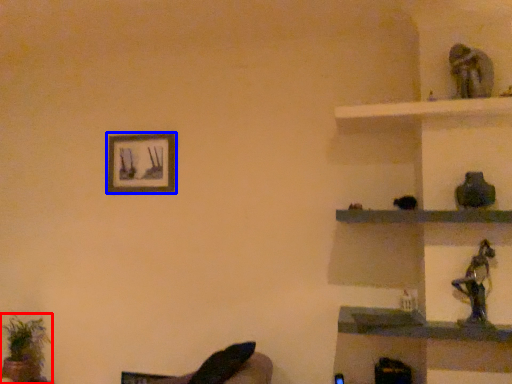
Question: Which point is closer to the camera, houseplant (highlighted by a red box) or picture frame (highlighted by a blue box)?

Choices:
 (A) houseplant
 (B) picture frame

Answer: (A)